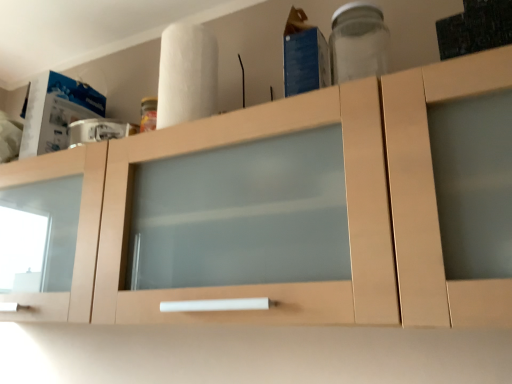
Question: From a real-world perspective, is transparent glass jar at upper right beneath light wood cabinet at center?

Choices:
 (A) no
 (B) yes

Answer: (A)

Question: Would you say transparent glass jar at upper right is outside light wood cabinet at center?

Choices:
 (A) no
 (B) yes

Answer: (B)

Question: Is transparent glass jar at upper right closer to the viewer compared to light wood cabinet at center?

Choices:
 (A) no
 (B) yes

Answer: (A)

Question: Could light wood cabinet at center be considered to be inside transparent glass jar at upper right?

Choices:
 (A) no
 (B) yes

Answer: (A)

Question: Could you tell me if transparent glass jar at upper right is facing light wood cabinet at center?

Choices:
 (A) yes
 (B) no

Answer: (B)

Question: From a real-world perspective, is transparent glass jar at upper right on light wood cabinet at center?

Choices:
 (A) no
 (B) yes

Answer: (B)

Question: From the image's perspective, is light wood cabinet at center under white matte paper towel at upper center?

Choices:
 (A) yes
 (B) no

Answer: (A)

Question: Considering the relative positions of light wood cabinet at center and white matte paper towel at upper center in the image provided, is light wood cabinet at center to the right of white matte paper towel at upper center from the viewer's perspective?

Choices:
 (A) yes
 (B) no

Answer: (B)

Question: Is light wood cabinet at center smaller than white matte paper towel at upper center?

Choices:
 (A) yes
 (B) no

Answer: (B)

Question: From a real-world perspective, does light wood cabinet at center sit lower than white matte paper towel at upper center?

Choices:
 (A) no
 (B) yes

Answer: (B)

Question: Is white matte paper towel at upper center surrounded by light wood cabinet at center?

Choices:
 (A) yes
 (B) no

Answer: (B)

Question: From the image's perspective, is light wood cabinet at center located above white matte paper towel at upper center?

Choices:
 (A) no
 (B) yes

Answer: (A)

Question: Considering the relative sizes of white matte paper towel at upper center and transparent glass jar at upper right in the image provided, is white matte paper towel at upper center thinner than transparent glass jar at upper right?

Choices:
 (A) yes
 (B) no

Answer: (A)